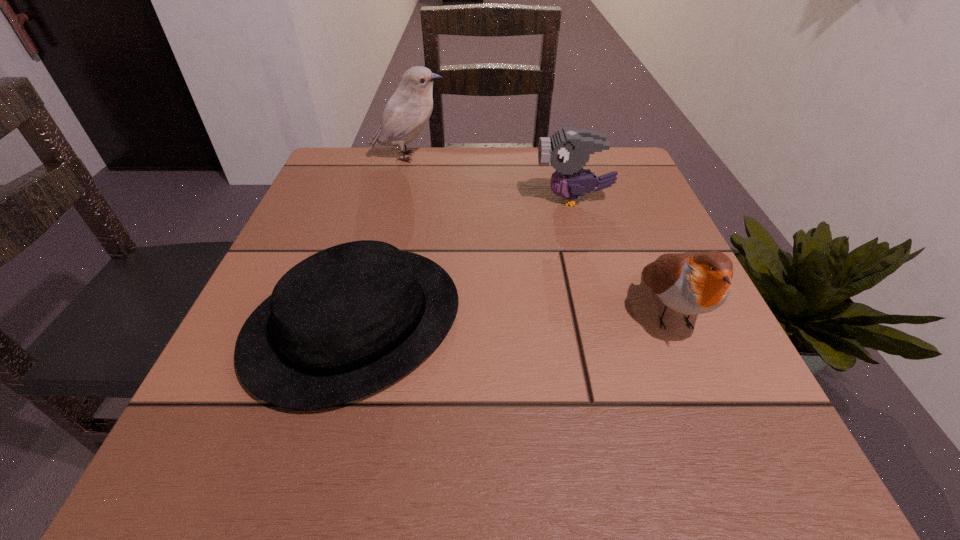
Find the location of a particular element. The width and height of the screenshot is (960, 540). the tallest bird is located at coordinates (408, 110).

Locate an element on the screen. the tallest object is located at coordinates (408, 110).

This screenshot has height=540, width=960. In order to click on the nearest bird in this screenshot , I will do `click(692, 283)`.

Find the location of a particular element. the second nearest bird is located at coordinates (568, 149).

This screenshot has width=960, height=540. I want to click on the shortest object, so click(x=345, y=322).

This screenshot has width=960, height=540. What are the coordinates of `vacant space located at the beak of the tallest object` in the screenshot? It's located at (581, 157).

I want to click on free spot located 0.100m at the face of the nearest bird, so click(718, 424).

This screenshot has width=960, height=540. In order to click on vacant space located at the beak of the second farthest bird in this screenshot , I will do `click(512, 199)`.

The width and height of the screenshot is (960, 540). Identify the location of vacant position located at the beak of the second farthest bird. (429, 199).

The width and height of the screenshot is (960, 540). Find the location of `vacant area situated at the beak of the second farthest bird`. vacant area situated at the beak of the second farthest bird is located at coordinates (447, 199).